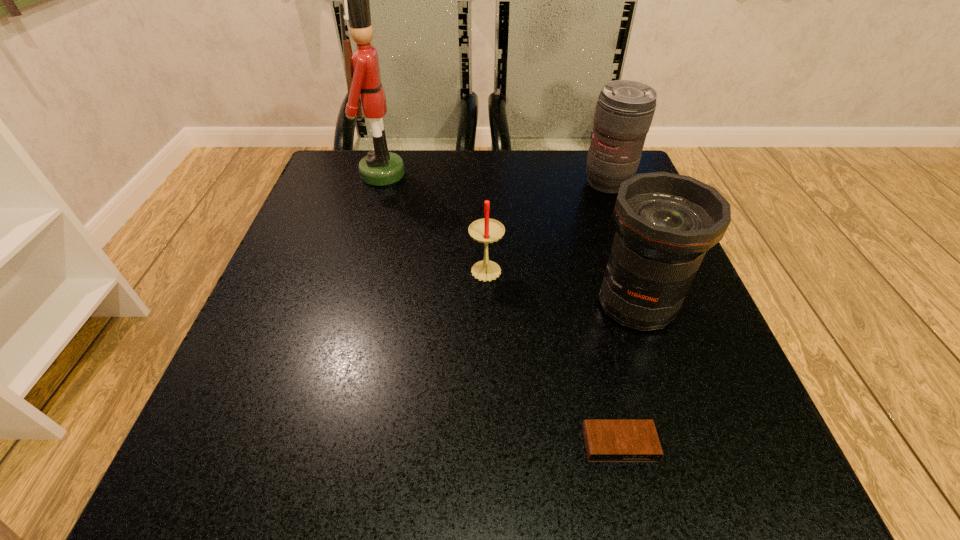
Where is `the leftmost object`? This screenshot has width=960, height=540. the leftmost object is located at coordinates (380, 167).

The height and width of the screenshot is (540, 960). I want to click on nutcracker, so click(x=380, y=167).

Find the location of `the farther telephoto lens`. the farther telephoto lens is located at coordinates (624, 111).

Identify the location of the nearer telephoto lens. (666, 222).

Locate an element on the screen. Image resolution: width=960 pixels, height=540 pixels. candle is located at coordinates (486, 230).

Identify the location of the fourth object from right to left. The width and height of the screenshot is (960, 540). (486, 230).

I want to click on alarm clock, so click(x=606, y=440).

Where is `the shortest object`? the shortest object is located at coordinates (606, 440).

Find the location of a particular element. This screenshot has height=540, width=960. vacant space situated 0.240m on the front-facing side of the leftmost object is located at coordinates (504, 174).

At what (x,y) coordinates should I click in order to perform the action: click on vacant space situated on the side of the farther telephoto lens where the control switches are located. Please return your answer as a coordinate pair (x, y). The height and width of the screenshot is (540, 960). Looking at the image, I should click on (656, 312).